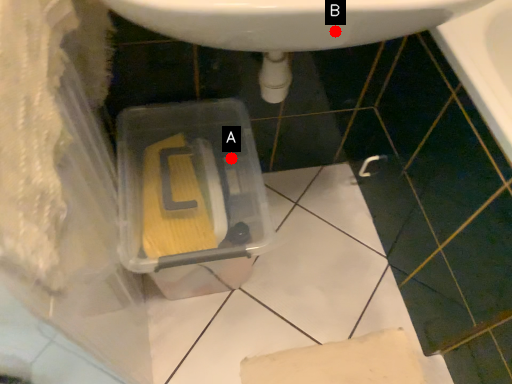
Question: Two points are circled on the image, labeled by A and B beside each circle. Which point is closer to the camera?

Choices:
 (A) A is closer
 (B) B is closer

Answer: (B)